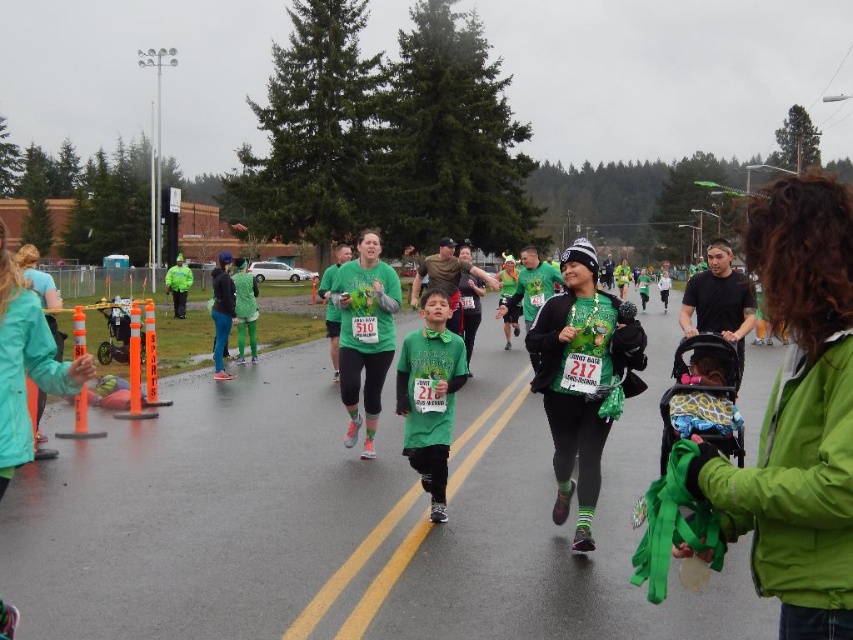
Question: Considering the relative positions of green matte jacket at center and matte green jacket at center in the image provided, where is green matte jacket at center located with respect to matte green jacket at center?

Choices:
 (A) left
 (B) right

Answer: (A)

Question: Does green matte jacket at center appear under matte green jacket at center?

Choices:
 (A) no
 (B) yes

Answer: (A)

Question: Which point is closer to the camera taking this photo?

Choices:
 (A) click(x=791, y=364)
 (B) click(x=573, y=412)

Answer: (A)

Question: Is green matte jacket at center positioned behind matte green jacket at center?

Choices:
 (A) no
 (B) yes

Answer: (A)